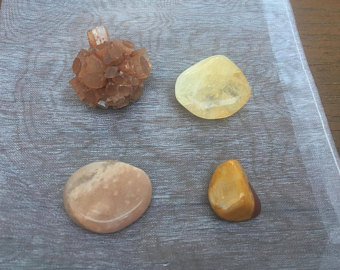
The width and height of the screenshot is (340, 270). Identify the location of placemat. (276, 95).